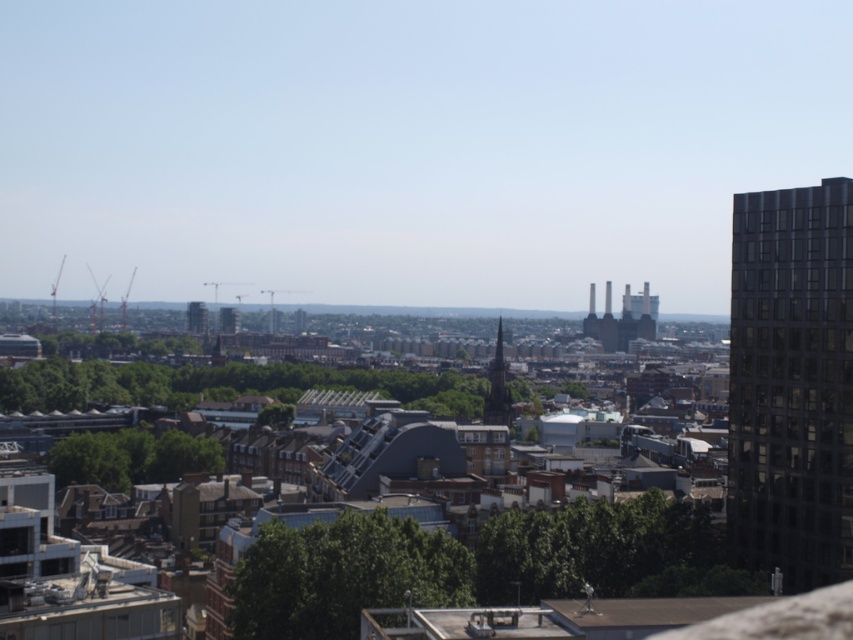
Question: Observing the image, what is the correct spatial positioning of dark gray stone spire at center in reference to matte gray building at center?

Choices:
 (A) right
 (B) left

Answer: (A)

Question: Considering the relative positions of dark gray stone spire at center and dark gray glass tower at center in the image provided, where is dark gray stone spire at center located with respect to dark gray glass tower at center?

Choices:
 (A) above
 (B) below

Answer: (B)

Question: Among these points, which one is farthest from the camera?

Choices:
 (A) (502, 385)
 (B) (195, 301)
 (C) (221, 321)
 (D) (738, 262)

Answer: (B)

Question: Can you confirm if dark glass building at right is positioned above matte gray building at center?

Choices:
 (A) no
 (B) yes

Answer: (A)

Question: Which of the following is the closest to the observer?

Choices:
 (A) (491, 392)
 (B) (752, 378)
 (C) (196, 317)
 (D) (225, 307)

Answer: (B)

Question: Which point appears closest to the camera in this image?

Choices:
 (A) (228, 324)
 (B) (737, 308)

Answer: (B)